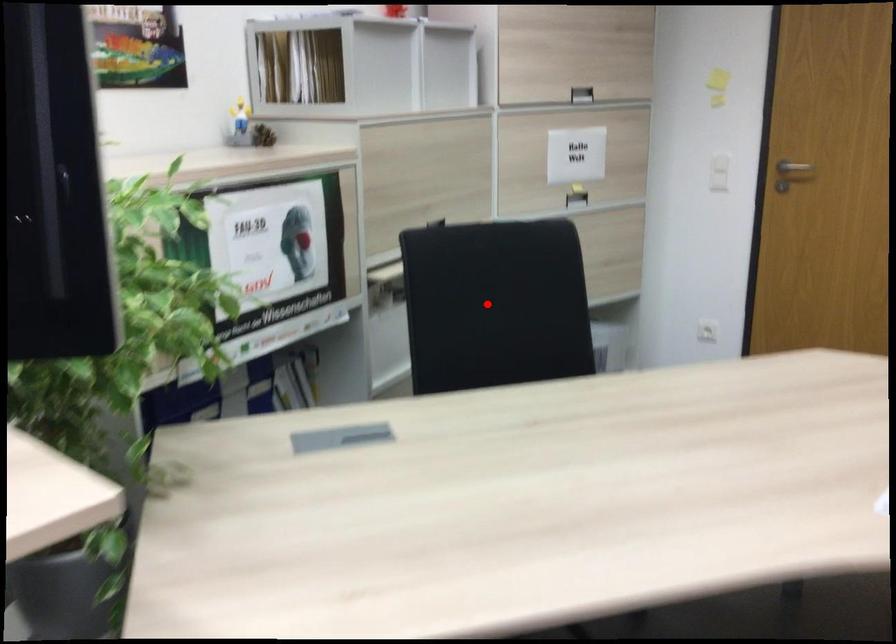
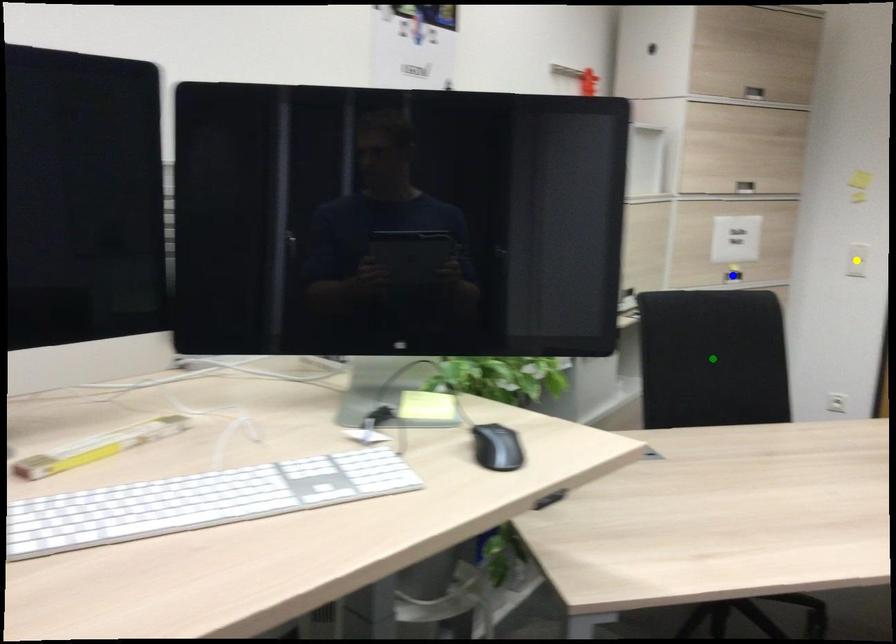
Question: I am providing you with two images of the same scene from different viewpoints. A red point is marked on the first image. You are given multiple points on the second image. Which mark in image 2 goes with the point in image 1?

Choices:
 (A) yellow point
 (B) green point
 (C) blue point

Answer: (B)